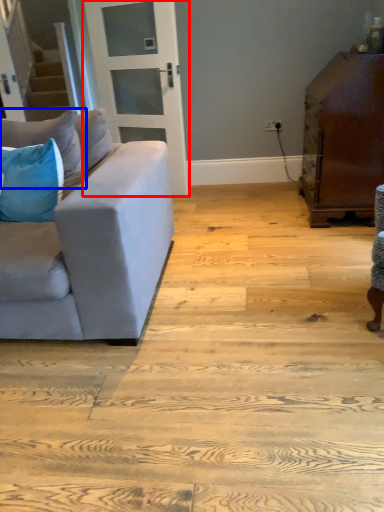
Question: Among these objects, which one is farthest to the camera, door (highlighted by a red box) or pillow (highlighted by a blue box)?

Choices:
 (A) door
 (B) pillow

Answer: (A)